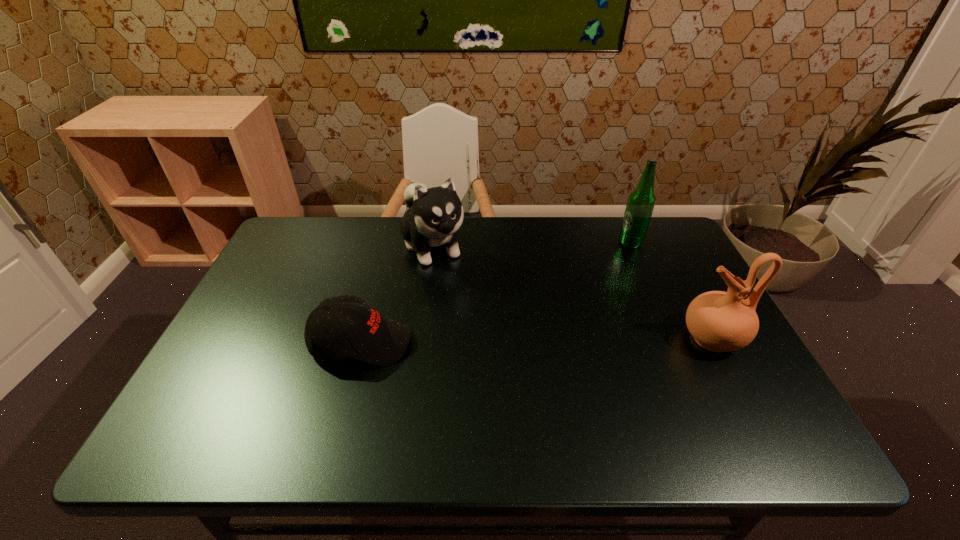
The image size is (960, 540). What are the coordinates of `baseball cap` in the screenshot? It's located at (372, 338).

I want to click on pottery, so click(x=719, y=321).

I want to click on beer bottle, so click(x=641, y=201).

Identify the location of puppy. (434, 217).

Find the location of a particular element. The height and width of the screenshot is (540, 960). vacant region located on the front-facing side of the shortest object is located at coordinates (432, 342).

Where is `free space located on the spout of the pottery`? The height and width of the screenshot is (540, 960). free space located on the spout of the pottery is located at coordinates (581, 339).

I want to click on free space located 0.110m on the spout of the pottery, so (636, 339).

The height and width of the screenshot is (540, 960). Identify the location of vacant area situated 0.090m on the spout of the pottery. (645, 339).

Identify the location of free point located 0.370m on the label of the beer bottle. (579, 323).

The height and width of the screenshot is (540, 960). In order to click on vacant space located 0.090m on the label of the beer bottle in this screenshot , I will do `click(616, 265)`.